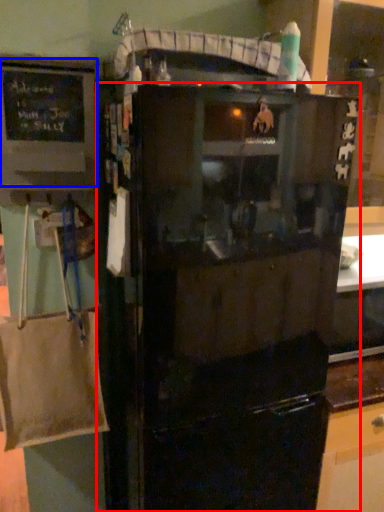
Question: Which object appears closest to the camera in this image, refrigerator (highlighted by a red box) or bulletin board (highlighted by a blue box)?

Choices:
 (A) refrigerator
 (B) bulletin board

Answer: (A)